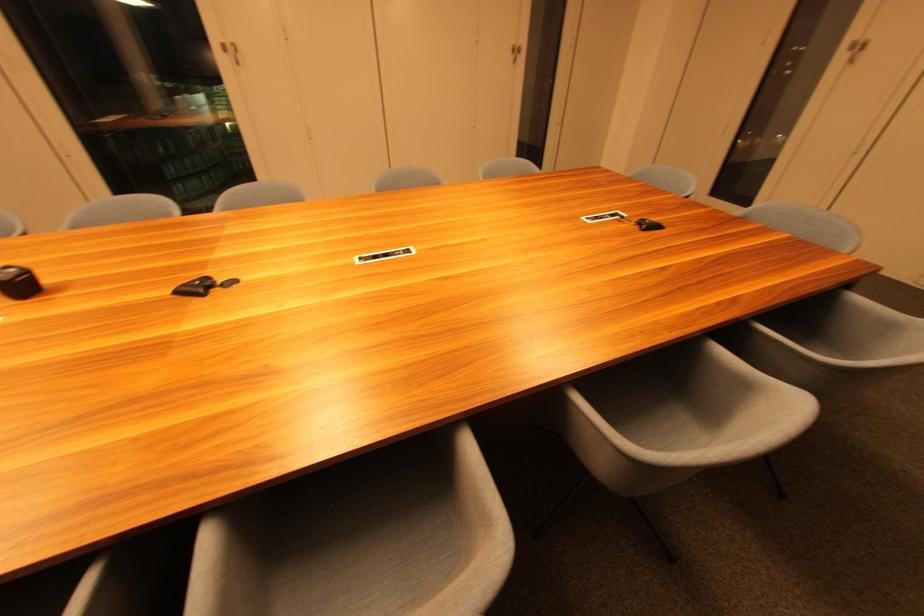
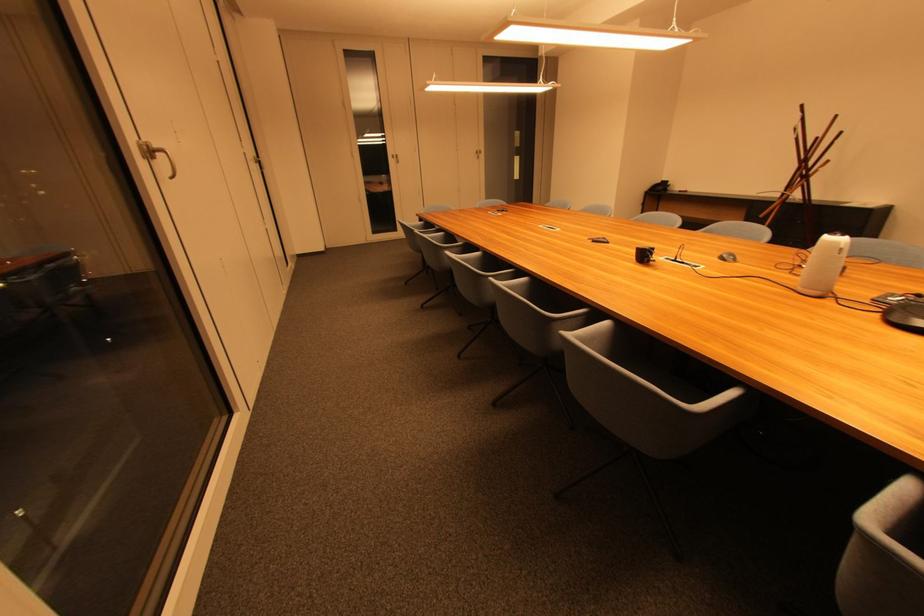
Find the pixel in the second image that matches point 245,286 in the first image.

(596, 240)